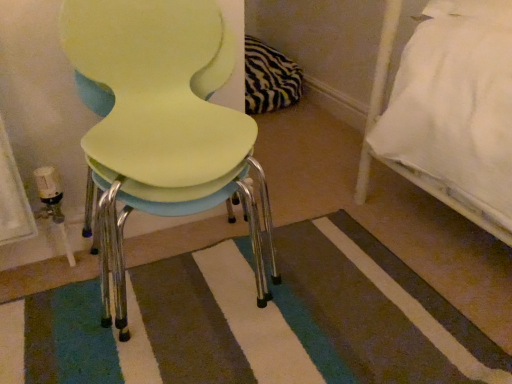
Identify the location of vacant area that lies to the right of matte yellow chair at center. (338, 278).